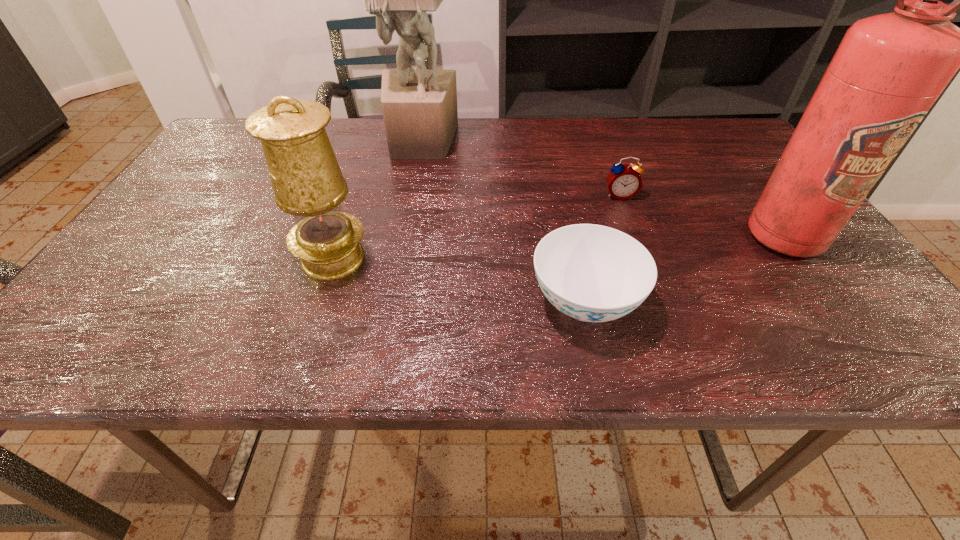
Identify the location of vacant space that's between the second farthest object and the sculpture. (520, 168).

Locate an element on the screen. vacant area that lies between the rightmost object and the fourth nearest object is located at coordinates (702, 217).

Where is `free spot between the chinaware and the oil lamp`? This screenshot has width=960, height=540. free spot between the chinaware and the oil lamp is located at coordinates (459, 281).

At what (x,y) coordinates should I click in order to perform the action: click on free space between the rightmost object and the chinaware. Please return your answer as a coordinate pair (x, y). The width and height of the screenshot is (960, 540). Looking at the image, I should click on (684, 270).

Locate an element on the screen. The image size is (960, 540). vacant area that lies between the chinaware and the rightmost object is located at coordinates (684, 270).

Identify the location of free space between the chinaware and the oil lamp. (459, 281).

Where is `free space between the chinaware and the third shortest object`? Image resolution: width=960 pixels, height=540 pixels. free space between the chinaware and the third shortest object is located at coordinates (459, 281).

At what (x,y) coordinates should I click in order to perform the action: click on empty location between the sculpture and the alarm clock. Please return your answer as a coordinate pair (x, y). Looking at the image, I should click on (520, 168).

This screenshot has width=960, height=540. What are the coordinates of `object that stands as the second closest to the alarm clock` in the screenshot? It's located at (592, 273).

Image resolution: width=960 pixels, height=540 pixels. Identify the location of object that stands as the fourth closest to the third tallest object. [889, 69].